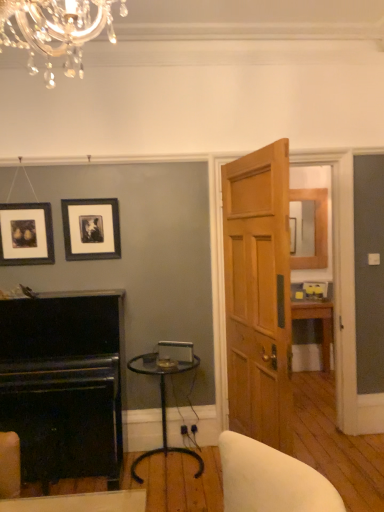
Question: Is light brown wooden door at center smaller than black polished wood fireplace at lower left?

Choices:
 (A) yes
 (B) no

Answer: (A)

Question: Considering the relative sizes of light brown wooden door at center and black polished wood fireplace at lower left in the image provided, is light brown wooden door at center wider than black polished wood fireplace at lower left?

Choices:
 (A) yes
 (B) no

Answer: (B)

Question: Is black polished wood fireplace at lower left at the back of light brown wooden door at center?

Choices:
 (A) yes
 (B) no

Answer: (A)

Question: Considering the relative sizes of light brown wooden door at center and black polished wood fireplace at lower left in the image provided, is light brown wooden door at center shorter than black polished wood fireplace at lower left?

Choices:
 (A) no
 (B) yes

Answer: (A)

Question: Considering the relative sizes of light brown wooden door at center and black polished wood fireplace at lower left in the image provided, is light brown wooden door at center taller than black polished wood fireplace at lower left?

Choices:
 (A) yes
 (B) no

Answer: (A)

Question: From a real-world perspective, is black matte picture frame at upper center, acting as the first picture frame starting from the right, physically located above or below clear glass table at center?

Choices:
 (A) below
 (B) above

Answer: (B)

Question: Do you think black matte picture frame at upper center, acting as the first picture frame starting from the right, is within clear glass table at center, or outside of it?

Choices:
 (A) outside
 (B) inside

Answer: (A)

Question: Relative to clear glass table at center, is black matte picture frame at upper center, placed as the second picture frame when sorted from left to right, in front or behind?

Choices:
 (A) front
 (B) behind

Answer: (B)

Question: Is black matte picture frame at upper center, placed as the second picture frame when sorted from left to right, wider or thinner than clear glass table at center?

Choices:
 (A) thin
 (B) wide

Answer: (A)

Question: Considering the positions of light brown wooden door at center and black matte picture frame at upper center, placed as the second picture frame when sorted from left to right, in the image, is light brown wooden door at center bigger or smaller than black matte picture frame at upper center, placed as the second picture frame when sorted from left to right,?

Choices:
 (A) small
 (B) big

Answer: (B)

Question: From their relative heights in the image, would you say light brown wooden door at center is taller or shorter than black matte picture frame at upper center, placed as the second picture frame when sorted from left to right?

Choices:
 (A) tall
 (B) short

Answer: (A)

Question: Would you say light brown wooden door at center is inside or outside black matte picture frame at upper center, placed as the second picture frame when sorted from left to right?

Choices:
 (A) inside
 (B) outside

Answer: (B)

Question: From a real-world perspective, is light brown wooden door at center positioned above or below black matte picture frame at upper center, acting as the first picture frame starting from the right?

Choices:
 (A) above
 (B) below

Answer: (B)

Question: Relative to black polished wood fireplace at lower left, is matte black picture frame at upper left, the second picture frame positioned from the right, in front or behind?

Choices:
 (A) front
 (B) behind

Answer: (B)

Question: In terms of width, does matte black picture frame at upper left, the second picture frame positioned from the right, look wider or thinner when compared to black polished wood fireplace at lower left?

Choices:
 (A) thin
 (B) wide

Answer: (A)